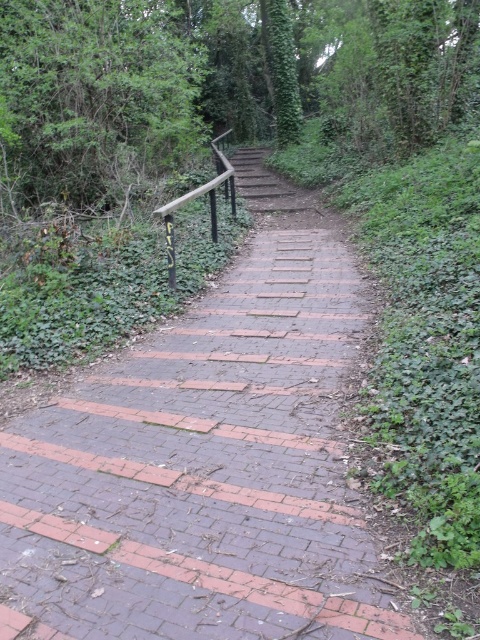
Between brick at center and green leafy tree at upper left, which one appears on the left side from the viewer's perspective?

green leafy tree at upper left

Who is more forward, (247, 285) or (136, 45)?

Point (247, 285) is more forward.

Does point (226, 353) come in front of point (83, 60)?

Yes, it is.

The height and width of the screenshot is (640, 480). I want to click on brick at center, so click(202, 472).

Is brick at center shorter than wooden rail at upper center?

Yes, brick at center is shorter than wooden rail at upper center.

Who is positioned more to the right, brick at center or wooden rail at upper center?

Positioned to the right is brick at center.

Who is more distant from viewer, (230,464) or (201,188)?

The point (201,188) is behind.

Where is `brick at center`? The height and width of the screenshot is (640, 480). brick at center is located at coordinates (202, 472).

Is green leafy tree at upper left positioned behind wooden rail at upper center?

Yes.

Which of these two, green leafy tree at upper left or wooden rail at upper center, stands taller?

With more height is wooden rail at upper center.

Which is in front, point (26, 90) or point (210, 205)?

Point (26, 90)

At what (x,y) coordinates should I click in order to perform the action: click on green leafy tree at upper left. Please return your answer as a coordinate pair (x, y). Looking at the image, I should click on (94, 99).